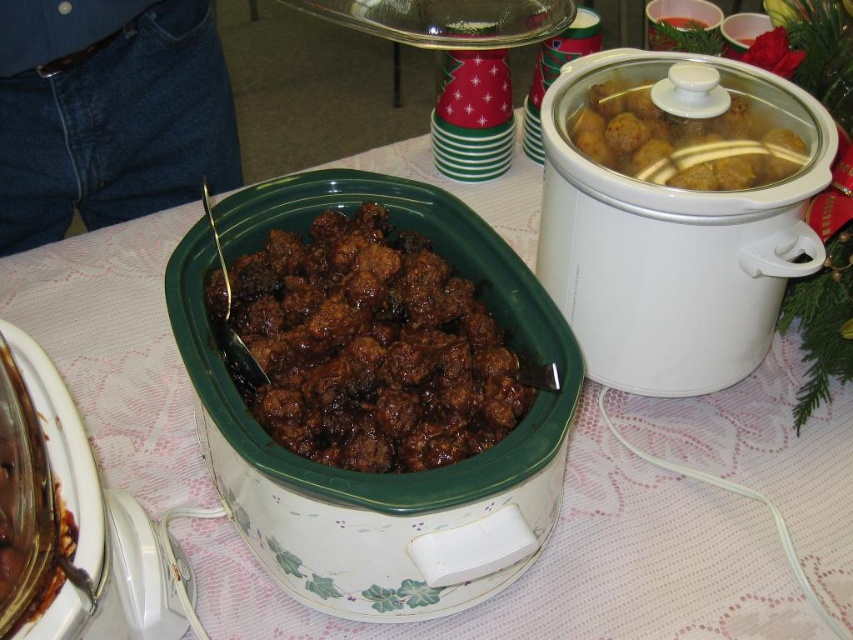
Looking at this image, does white matte slow cooker at center right have a greater height compared to white glossy crock pot at center?

No, white matte slow cooker at center right is not taller than white glossy crock pot at center.

In the scene shown: Is white matte slow cooker at center right below white glossy crock pot at center?

No.

Where is `white matte slow cooker at center right`? white matte slow cooker at center right is located at coordinates (676, 212).

Find the location of `white matte slow cooker at center right`. white matte slow cooker at center right is located at coordinates (676, 212).

What do you see at coordinates (379, 474) in the screenshot? I see `white glossy crock pot at center` at bounding box center [379, 474].

Which of these two, white glossy crock pot at center or white glossy slow cooker at center, stands taller?

With more height is white glossy crock pot at center.

Image resolution: width=853 pixels, height=640 pixels. I want to click on white glossy crock pot at center, so click(379, 474).

This screenshot has height=640, width=853. What do you see at coordinates (364, 348) in the screenshot?
I see `brown glossy meatballs at center` at bounding box center [364, 348].

Is point (483, 305) less distant than point (86, 636)?

No, (483, 305) is further to viewer.

Does point (445, 440) come in front of point (74, 632)?

No.

Locate an element on the screen. This screenshot has height=640, width=853. brown glossy meatballs at center is located at coordinates (364, 348).